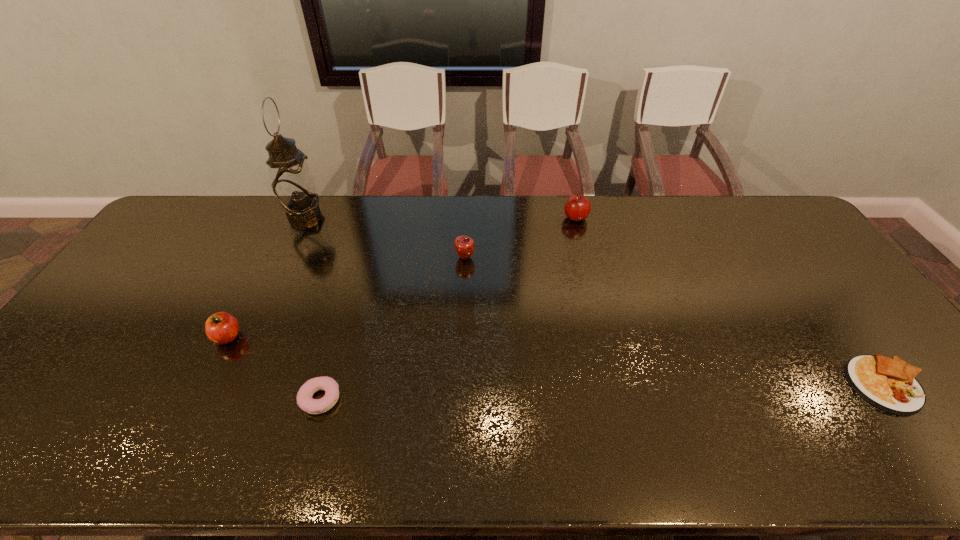
You are a GUI agent. You are given a task and a screenshot of the screen. Output one action in this format:
    pyautogui.click(x=<x>, y=<y>)
    Task: Click on the vacant space at the far edge
    The height and width of the screenshot is (540, 960).
    Given the screenshot: What is the action you would take?
    pyautogui.click(x=688, y=237)

What are the coordinates of `free space at the near edge` in the screenshot? It's located at (845, 437).

At what (x,y) coordinates should I click in order to perform the action: click on vacant area at the left edge. Please return your answer as a coordinate pair (x, y). The image size is (960, 540). Looking at the image, I should click on (102, 371).

You are a GUI agent. You are given a task and a screenshot of the screen. Output one action in this format:
    pyautogui.click(x=<x>, y=<y>)
    Task: Click on the free location at the right edge
    
    Given the screenshot: What is the action you would take?
    pyautogui.click(x=796, y=267)

Image resolution: width=960 pixels, height=540 pixels. I want to click on free region at the far left corner, so click(200, 214).

Where is `free spot at the far right corner of the desktop`? This screenshot has height=540, width=960. free spot at the far right corner of the desktop is located at coordinates (779, 213).

Image resolution: width=960 pixels, height=540 pixels. In order to click on vacant point located between the fourth farthest object and the second nearest apple in this screenshot , I will do `click(347, 297)`.

At what (x,y) coordinates should I click in order to perform the action: click on vacant region between the rightmost apple and the second apple from right to left. Please return your answer as a coordinate pair (x, y). This screenshot has width=960, height=540. Looking at the image, I should click on (520, 238).

Find the location of `blank region between the second apple from left to right and the shortest object`. blank region between the second apple from left to right and the shortest object is located at coordinates (676, 321).

This screenshot has width=960, height=540. Identify the location of vacant area that lies between the second nearest apple and the second tallest object. (520, 238).